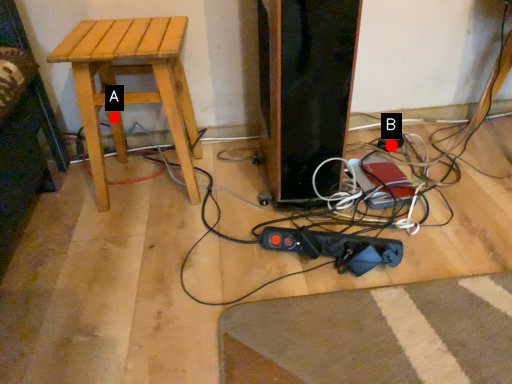
Question: Two points are circled on the image, labeled by A and B beside each circle. Among these points, which one is nearest to the camera?

Choices:
 (A) A is closer
 (B) B is closer

Answer: (A)